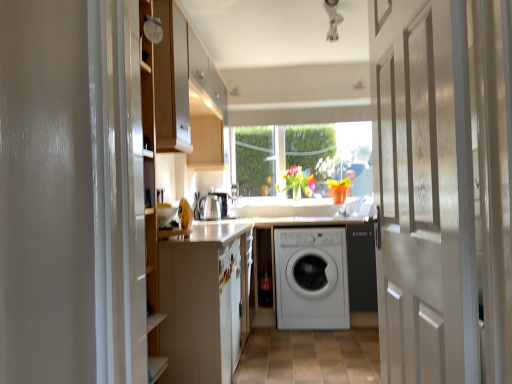
Question: Could vibrant glass vase at center be considered to be inside white glossy door at center?

Choices:
 (A) no
 (B) yes

Answer: (A)

Question: Is white glossy door at center touching vibrant glass vase at center?

Choices:
 (A) yes
 (B) no

Answer: (B)

Question: Is white glossy door at center aimed at vibrant glass vase at center?

Choices:
 (A) yes
 (B) no

Answer: (B)

Question: Can you confirm if white glossy door at center is thinner than vibrant glass vase at center?

Choices:
 (A) yes
 (B) no

Answer: (A)

Question: From a real-world perspective, is white glossy door at center physically above vibrant glass vase at center?

Choices:
 (A) yes
 (B) no

Answer: (B)

Question: Is white glossy door at center at the right side of vibrant glass vase at center?

Choices:
 (A) no
 (B) yes

Answer: (B)

Question: From a real-world perspective, is clear glass window at center over satin silver kettle at center?

Choices:
 (A) no
 (B) yes

Answer: (B)

Question: Can you confirm if clear glass window at center is shorter than satin silver kettle at center?

Choices:
 (A) no
 (B) yes

Answer: (A)

Question: Considering the relative sizes of clear glass window at center and satin silver kettle at center in the image provided, is clear glass window at center smaller than satin silver kettle at center?

Choices:
 (A) no
 (B) yes

Answer: (A)

Question: From the image's perspective, is clear glass window at center located beneath satin silver kettle at center?

Choices:
 (A) no
 (B) yes

Answer: (A)

Question: Is clear glass window at center oriented away from satin silver kettle at center?

Choices:
 (A) no
 (B) yes

Answer: (A)

Question: From the image's perspective, is clear glass window at center over satin silver kettle at center?

Choices:
 (A) yes
 (B) no

Answer: (A)

Question: From a real-world perspective, is white glossy door at center on white matte cabinet at left?

Choices:
 (A) yes
 (B) no

Answer: (A)